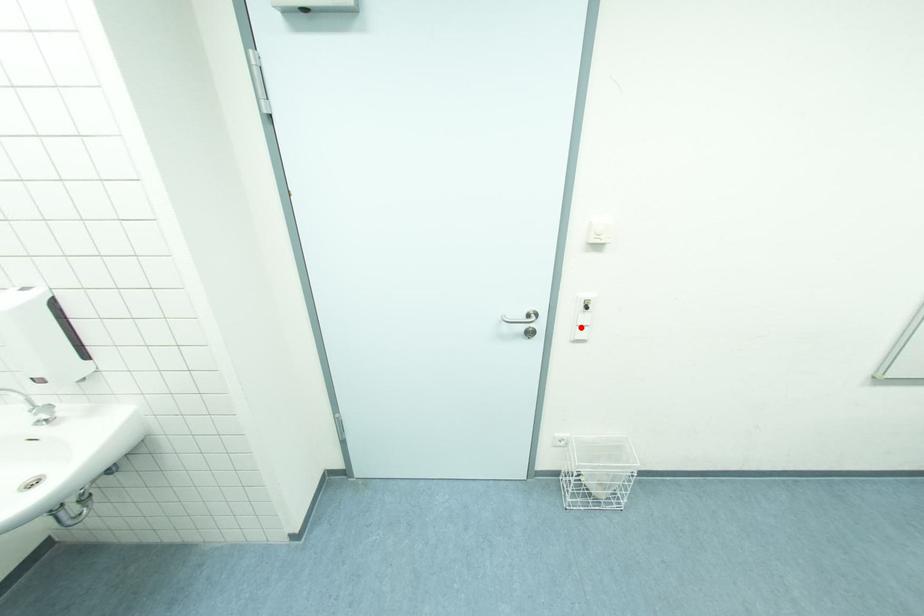
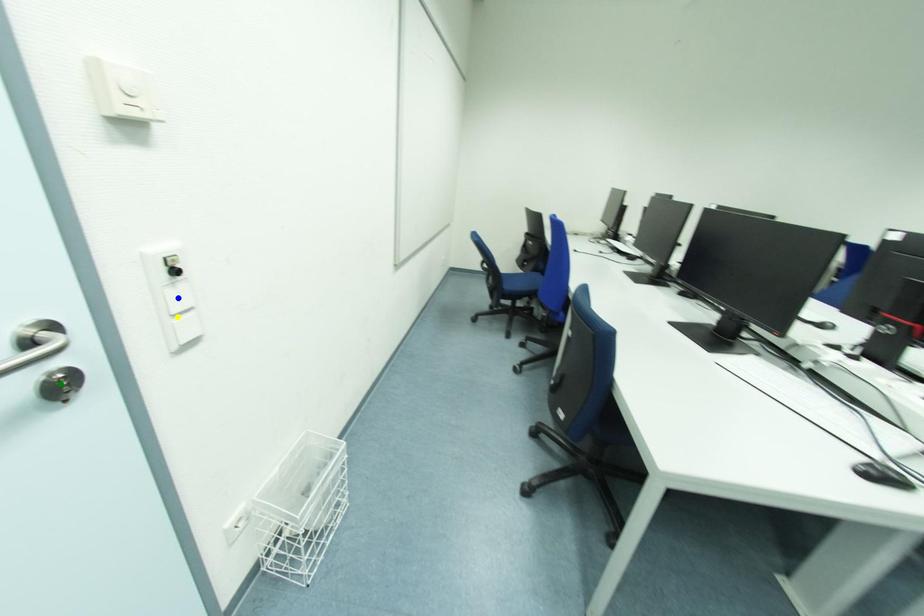
Question: I am providing you with two images of the same scene from different viewpoints. A red point is marked on the first image. You are given multiple points on the second image. Which point in image 2 is actually the same real-world point as the red point in image 1?

Choices:
 (A) blue point
 (B) green point
 (C) yellow point

Answer: (C)